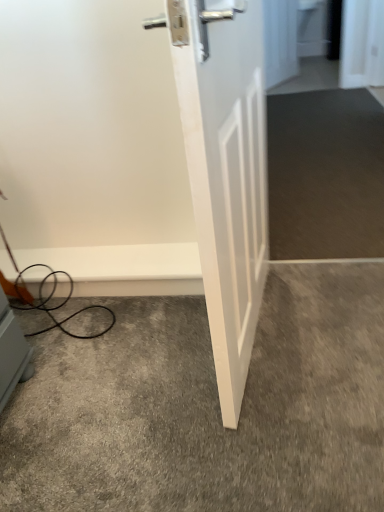
Question: Is white matte door at center taller or shorter than gray carpet at lower center?

Choices:
 (A) tall
 (B) short

Answer: (A)

Question: In the image, is white matte door at center positioned in front of or behind gray carpet at lower center?

Choices:
 (A) front
 (B) behind

Answer: (A)

Question: Is point (249, 41) positioned closer to the camera than point (380, 409)?

Choices:
 (A) farther
 (B) closer

Answer: (B)

Question: Considering the positions of gray carpet at lower center and white matte door at center in the image, is gray carpet at lower center taller or shorter than white matte door at center?

Choices:
 (A) tall
 (B) short

Answer: (B)

Question: From a real-world perspective, relative to white matte door at center, is gray carpet at lower center vertically above or below?

Choices:
 (A) above
 (B) below

Answer: (B)

Question: From the image's perspective, is gray carpet at lower center positioned above or below white matte door at center?

Choices:
 (A) below
 (B) above

Answer: (A)

Question: Is gray carpet at lower center to the left or to the right of white matte door at center in the image?

Choices:
 (A) left
 (B) right

Answer: (A)